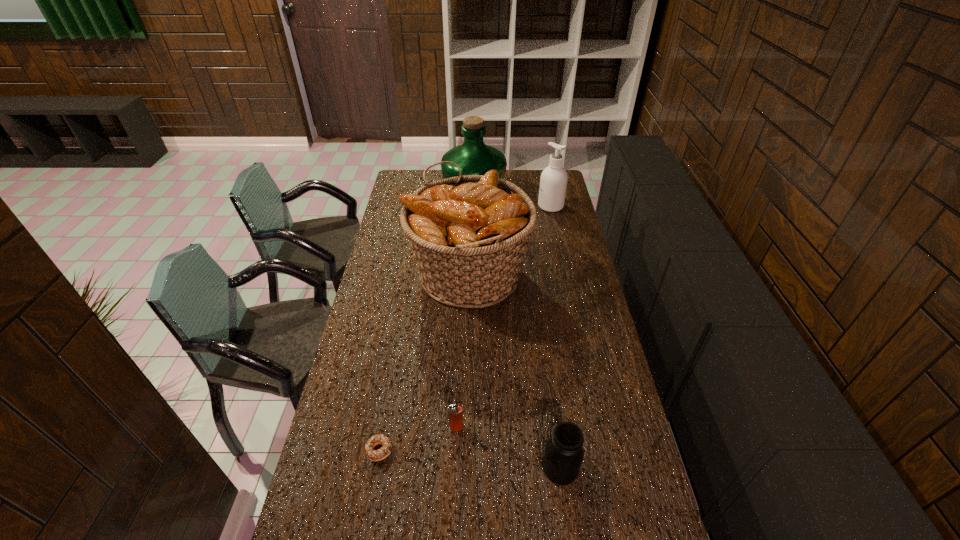
Where is `liquor`? liquor is located at coordinates (474, 157).

The height and width of the screenshot is (540, 960). I want to click on the third farthest object, so click(x=469, y=233).

Identify the location of the third tallest object. The image size is (960, 540). pos(553,183).

This screenshot has width=960, height=540. In order to click on cleansing agent in this screenshot , I will do pos(553,183).

In order to click on the third shortest object in this screenshot , I will do [563, 455].

Identify the location of igniter. The image size is (960, 540). (455, 415).

Identify the location of the fifth tallest object. (455, 415).

Identify the location of the shortest object. (374, 455).

The height and width of the screenshot is (540, 960). I want to click on free location located on the label side of the liquor, so click(x=523, y=196).

This screenshot has width=960, height=540. Find the location of `vacant area situated 0.160m on the back of the fourth nearest object`. vacant area situated 0.160m on the back of the fourth nearest object is located at coordinates (470, 217).